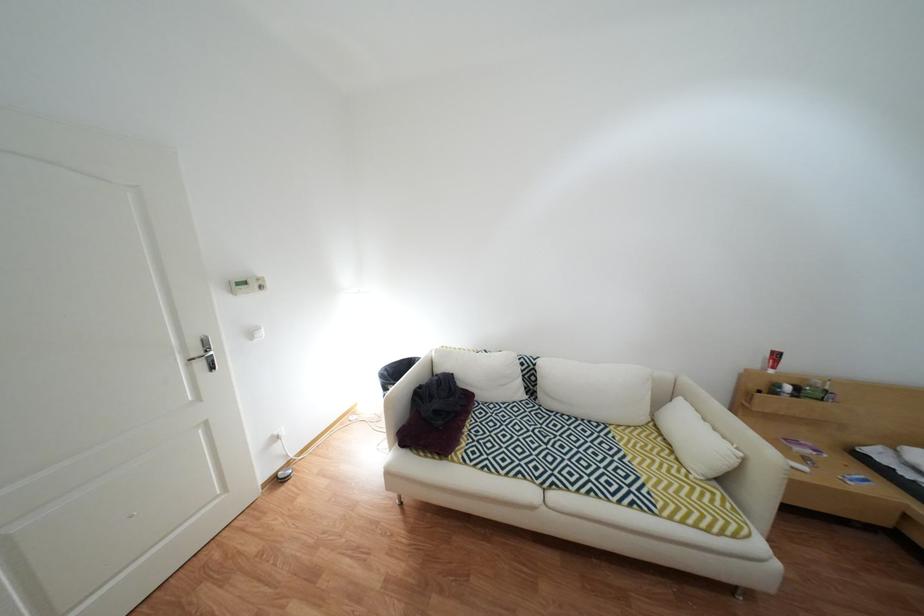
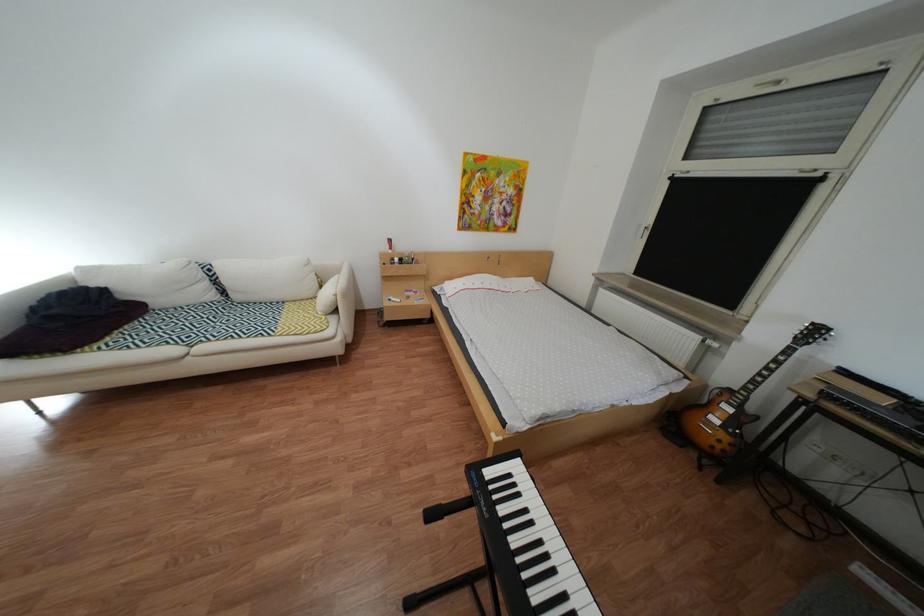
Find the pixel in the second image that matches (x=476, y=454) in the first image.

(113, 346)